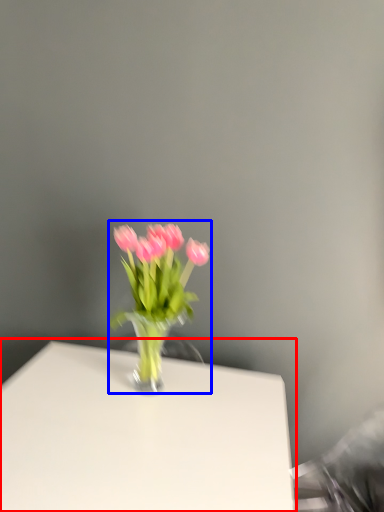
Question: Among these objects, which one is nearest to the camera, table (highlighted by a red box) or floral arrangement (highlighted by a blue box)?

Choices:
 (A) table
 (B) floral arrangement

Answer: (A)